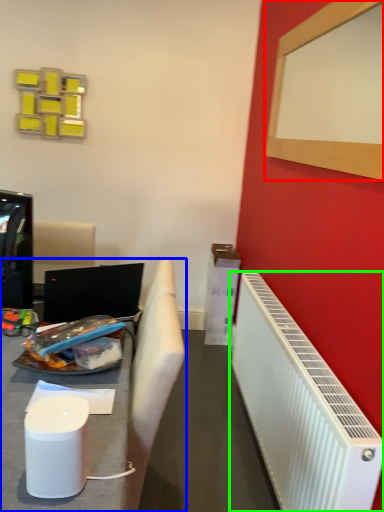
Question: Considering the real-world distances, which object is closest to bulletin board (highlighted by a red box)? furniture (highlighted by a blue box) or radiator (highlighted by a green box).

Choices:
 (A) furniture
 (B) radiator

Answer: (B)